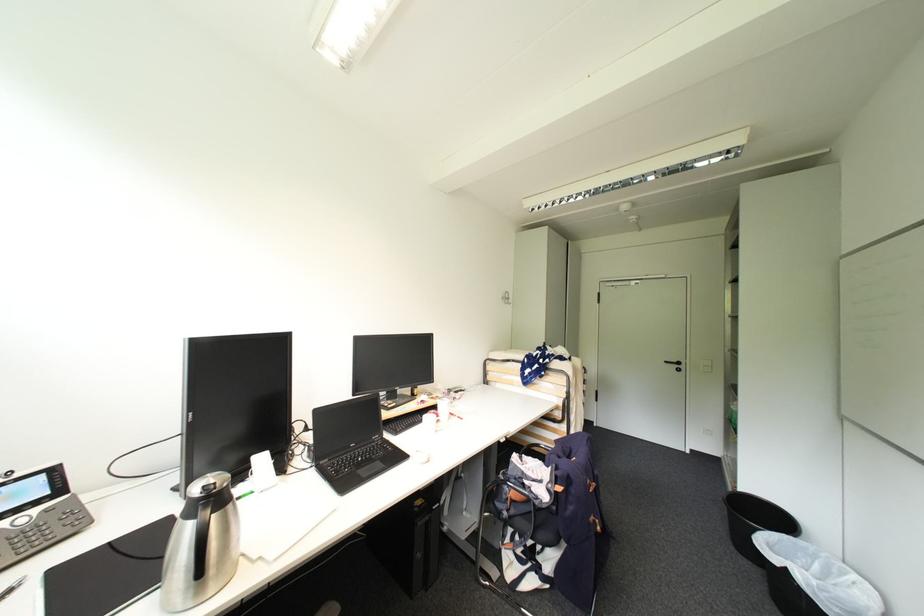
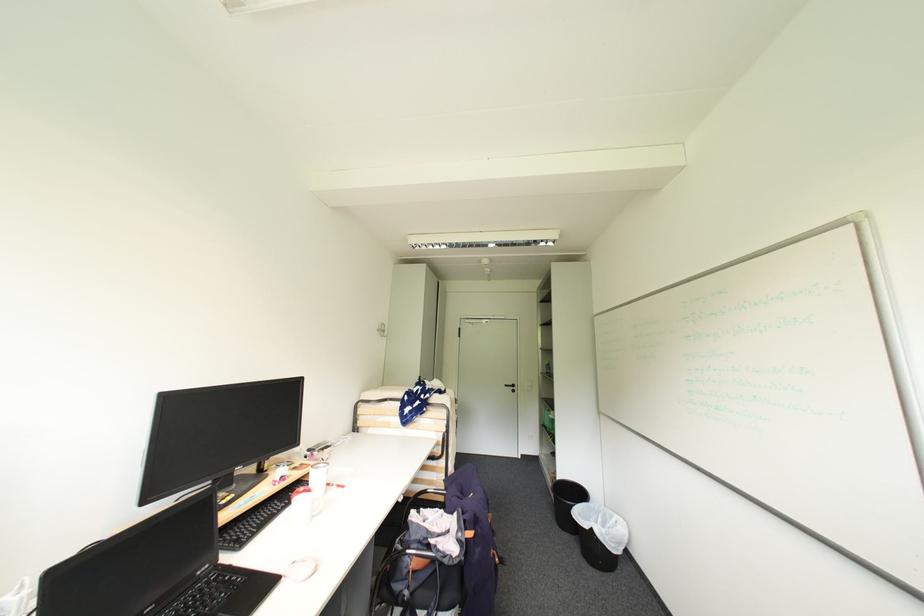
Locate, in the second image, the point that corresponds to point 530,485 in the first image.

(435, 548)